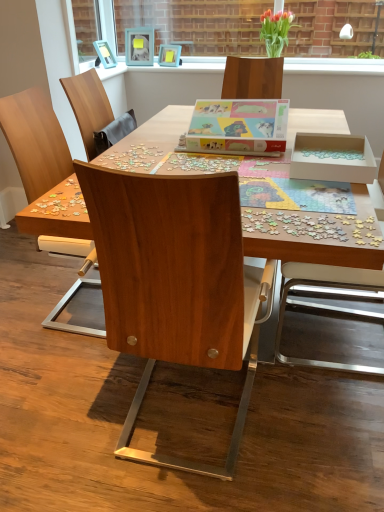
At what (x,y) coordinates should I click in order to perform the action: click on vacant area situated to the left side of wooden chair at center, marked as the 1th chair in a left-to-right arrangement. Please return your answer as a coordinate pair (x, y). Image resolution: width=384 pixels, height=512 pixels. Looking at the image, I should click on (29, 305).